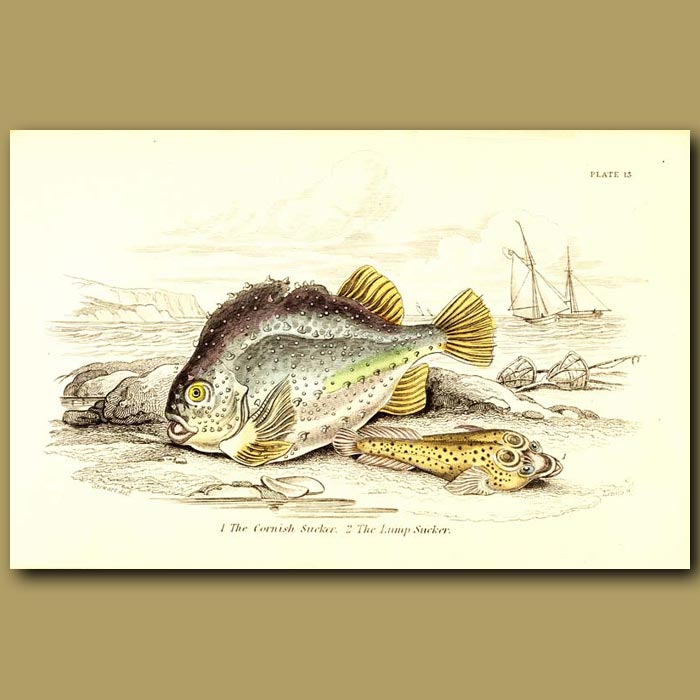
The height and width of the screenshot is (700, 700). Identify the location of wall. (578, 17).